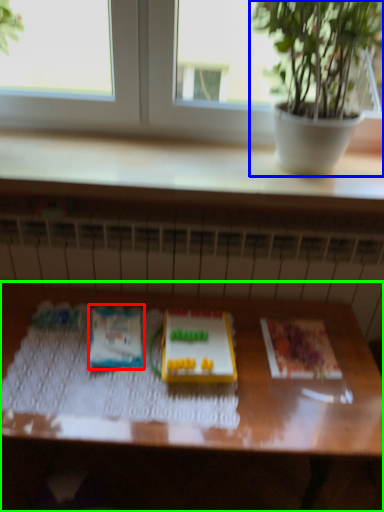
Question: Based on their relative distances, which object is farther from paperback book (highlighted by a red box)? Choose from houseplant (highlighted by a blue box) and table (highlighted by a green box).

Choices:
 (A) houseplant
 (B) table

Answer: (A)